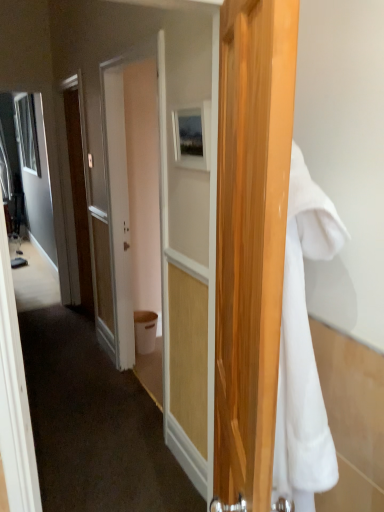
Image resolution: width=384 pixels, height=512 pixels. I want to click on white fluffy towel at right, so click(x=303, y=348).

In order to face white fluffy towel at right, should I rotate leftwards or rightwards?

You should look right and rotate roughly 14.463 degrees.

Find the location of `matte white door at center`. matte white door at center is located at coordinates point(79,198).

Image resolution: width=384 pixels, height=512 pixels. What are the coordinates of `white plastic trash bin at center` in the screenshot? It's located at (145, 331).

This screenshot has width=384, height=512. Describe the element at coordinates (192, 137) in the screenshot. I see `matte wooden picture frame at center` at that location.

In order to click on white fluffy towel at right in this screenshot , I will do `click(303, 348)`.

Is matte white door at center situated inside matte wooden picture frame at center or outside?

matte white door at center is outside matte wooden picture frame at center.

Which object is positioned more to the left, matte white door at center or matte wooden picture frame at center?

Positioned to the left is matte white door at center.

Is matte white door at center directly adjacent to matte wooden picture frame at center?

No, matte white door at center is not touching matte wooden picture frame at center.

From the image's perspective, is white fluffy towel at right on matte white door at center?

Incorrect, from the image's perspective, white fluffy towel at right is lower than matte white door at center.

Is point (296, 157) positioned after point (72, 88)?

No, it is not.

The height and width of the screenshot is (512, 384). In order to click on towel/napkin positioned vertically above the matte white door at center (from a real-world perspective) in this screenshot , I will do `click(303, 348)`.

Considering the relative sizes of white fluffy towel at right and matte white door at center in the image provided, is white fluffy towel at right taller than matte white door at center?

No.

In order to click on door above the white plastic trash bin at center (from a real-world perspective) in this screenshot , I will do `click(79, 198)`.

Is point (82, 298) farther from viewer compared to point (141, 339)?

Yes.

Considering the sizes of objects matte white door at center and white plastic trash bin at center in the image provided, who is thinner, matte white door at center or white plastic trash bin at center?

matte white door at center.

Is white fluffy towel at right shorter than white plastic trash bin at center?

No.

Is white fluffy towel at right wider than white plastic trash bin at center?

Yes.

Is white plastic trash bin at center surrounded by white fluffy towel at right?

No, white plastic trash bin at center is not surrounded by white fluffy towel at right.

Find the location of a particular element. This screenshot has height=512, width=384. towel/napkin that appears in front of the white plastic trash bin at center is located at coordinates (303, 348).

In the scene shown: Between white plastic trash bin at center and matte white door at center, which one has less height?

With less height is white plastic trash bin at center.

In the scene shown: Which is more to the right, white plastic trash bin at center or matte white door at center?

white plastic trash bin at center is more to the right.

Is white plastic trash bin at center situated inside matte white door at center or outside?

white plastic trash bin at center lies outside matte white door at center.

Looking at this image, is white fluffy towel at right in contact with matte wooden picture frame at center?

No, white fluffy towel at right is not touching matte wooden picture frame at center.

Between white fluffy towel at right and matte wooden picture frame at center, which one appears on the right side from the viewer's perspective?

white fluffy towel at right.

Is white fluffy towel at right aimed at matte wooden picture frame at center?

No, white fluffy towel at right does not turn towards matte wooden picture frame at center.

Considering the relative sizes of white fluffy towel at right and matte wooden picture frame at center in the image provided, is white fluffy towel at right shorter than matte wooden picture frame at center?

Incorrect, the height of white fluffy towel at right does not fall short of that of matte wooden picture frame at center.

From the image's perspective, between matte wooden picture frame at center and white plastic trash bin at center, which one is located above?

matte wooden picture frame at center.

From the picture: Is matte wooden picture frame at center closer to the viewer compared to white plastic trash bin at center?

Yes, it is in front of white plastic trash bin at center.

In the scene shown: Is matte wooden picture frame at center taller than white plastic trash bin at center?

Incorrect, the height of matte wooden picture frame at center is not larger of that of white plastic trash bin at center.

You are a GUI agent. You are given a task and a screenshot of the screen. Output one action in this format:
    pyautogui.click(x=<x>, y=<y>)
    Task: Click on the picture frame above the matte white door at center (from a real-world perspective)
    Image resolution: width=384 pixels, height=512 pixels.
    Given the screenshot: What is the action you would take?
    tap(192, 137)

You are a GUI agent. You are given a task and a screenshot of the screen. Output one action in this format:
    pyautogui.click(x=<x>, y=<y>)
    Task: Click on the door below the white fluffy towel at right (from a real-world perspective)
    The height and width of the screenshot is (512, 384).
    Given the screenshot: What is the action you would take?
    pyautogui.click(x=79, y=198)

Which object lies further to the anchor point white plastic trash bin at center, matte wooden picture frame at center or matte white door at center?

Based on the image, matte wooden picture frame at center appears to be further to white plastic trash bin at center.

Estimate the real-world distances between objects in this image. Which object is further from matte wooden picture frame at center, white fluffy towel at right or matte white door at center?

matte white door at center lies further to matte wooden picture frame at center than the other object.

Considering their positions, is matte white door at center positioned further to white plastic trash bin at center than matte wooden picture frame at center?

matte wooden picture frame at center is further to white plastic trash bin at center.

Based on the photo, from the image, which object appears to be farther from matte wooden picture frame at center, white fluffy towel at right or white plastic trash bin at center?

The object further to matte wooden picture frame at center is white plastic trash bin at center.

Which object lies further to the anchor point white plastic trash bin at center, white fluffy towel at right or matte white door at center?

white fluffy towel at right.

Which object lies further to the anchor point matte wooden picture frame at center, white plastic trash bin at center or matte white door at center?

The object further to matte wooden picture frame at center is matte white door at center.

From the picture: From the image, which object appears to be farther from white plastic trash bin at center, matte white door at center or white fluffy towel at right?

The object further to white plastic trash bin at center is white fluffy towel at right.

Based on their spatial positions, is matte wooden picture frame at center or white plastic trash bin at center closer to matte white door at center?

Based on the image, white plastic trash bin at center appears to be nearer to matte white door at center.

Identify the location of door positioned between white fluffy towel at right and white plastic trash bin at center from near to far. The image size is (384, 512). (79, 198).

Identify the location of picture frame located between white fluffy towel at right and matte white door at center in the depth direction. The width and height of the screenshot is (384, 512). (192, 137).

The width and height of the screenshot is (384, 512). I want to click on door located between matte wooden picture frame at center and white plastic trash bin at center in the depth direction, so coord(79,198).

The image size is (384, 512). I want to click on picture frame positioned between white fluffy towel at right and white plastic trash bin at center from near to far, so click(x=192, y=137).